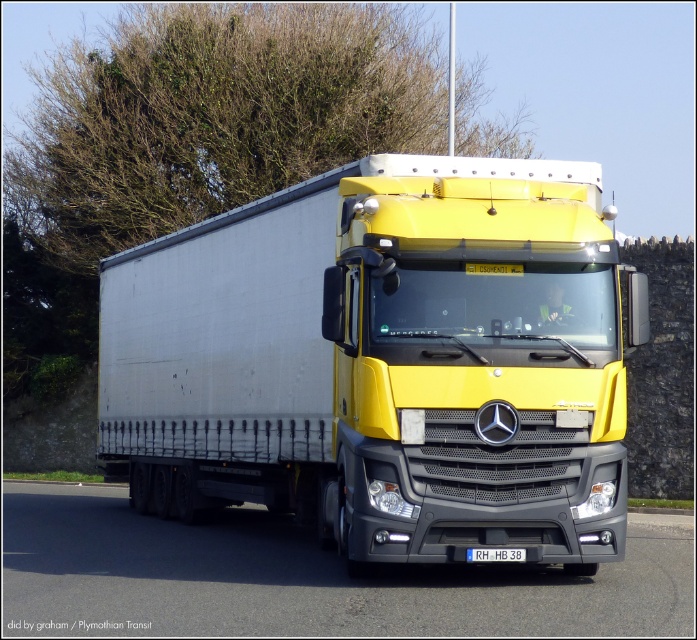
Question: Which is nearer to the white plastic license plate at center?

Choices:
 (A) black rubber highway at center
 (B) white matte trailer at center

Answer: (A)

Question: Is the position of black rubber highway at center more distant than that of white plastic license plate at center?

Choices:
 (A) no
 (B) yes

Answer: (A)

Question: Among these objects, which one is farthest from the camera?

Choices:
 (A) white matte trailer at center
 (B) green leafy tree at upper center
 (C) black rubber highway at center
 (D) white plastic license plate at center

Answer: (B)

Question: Considering the relative positions of white matte trailer at center and white plastic license plate at center in the image provided, where is white matte trailer at center located with respect to white plastic license plate at center?

Choices:
 (A) right
 (B) left

Answer: (B)

Question: Is white matte trailer at center wider than white plastic license plate at center?

Choices:
 (A) no
 (B) yes

Answer: (B)

Question: Estimate the real-world distances between objects in this image. Which object is closer to the white plastic license plate at center?

Choices:
 (A) white matte trailer at center
 (B) green leafy tree at upper center
 (C) black rubber highway at center

Answer: (C)